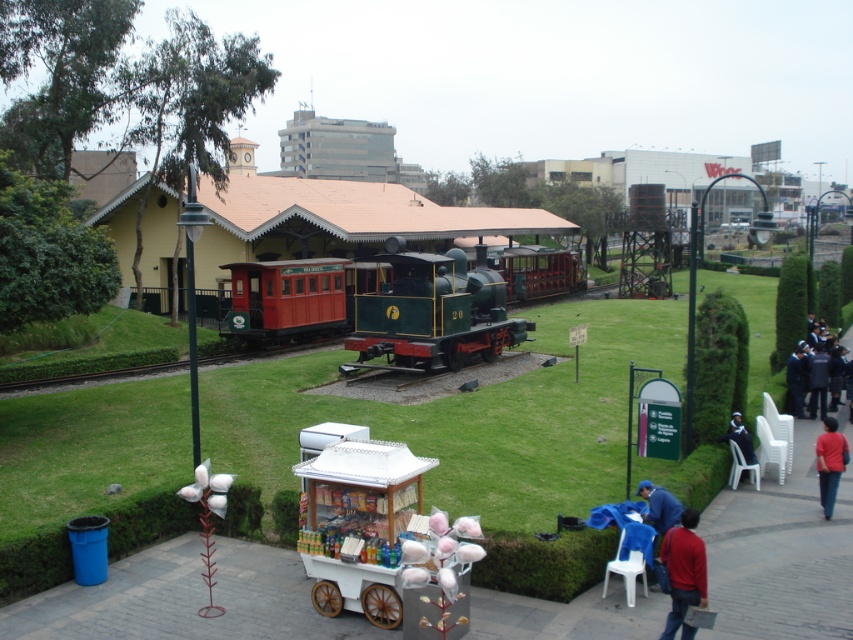
Which is behind, point (436, 275) or point (340, 310)?

The point (340, 310) is more distant.

Is green polished wood train at center behind red wooden train car at center?

No.

Who is more distant from viewer, (466, 316) or (315, 310)?

The point (315, 310) is more distant.

Where is `green polished wood train at center`? green polished wood train at center is located at coordinates (433, 310).

Which of these two, green metal train track at center or red cotton candy at lower right, stands shorter?

green metal train track at center

Is point (54, 378) positioned after point (822, 513)?

Yes.

Does point (173, 368) come farther from viewer compared to point (843, 442)?

Yes, it is behind point (843, 442).

At what (x,y) coordinates should I click in order to perform the action: click on green metal train track at center. Please return your answer as a coordinate pair (x, y). Looking at the image, I should click on (88, 378).

Is point (341, 308) positioned behind point (694, 525)?

Yes, it is behind point (694, 525).

Between red wooden train car at center and red matte jacket at lower right, which one has less height?

red matte jacket at lower right is shorter.

What do you see at coordinates (285, 300) in the screenshot? Image resolution: width=853 pixels, height=640 pixels. I see `red wooden train car at center` at bounding box center [285, 300].

At what (x,y) coordinates should I click in order to perform the action: click on red wooden train car at center. Please return your answer as a coordinate pair (x, y). The width and height of the screenshot is (853, 640). Looking at the image, I should click on (285, 300).